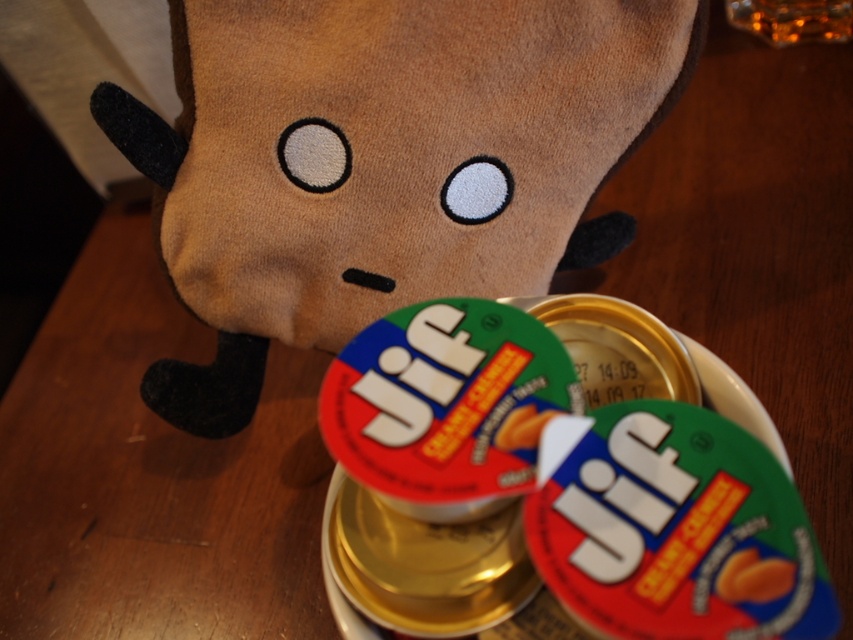
Can you confirm if brown plush toy at upper center is positioned above smooth plastic peanut butter cup at center?

Indeed, brown plush toy at upper center is positioned over smooth plastic peanut butter cup at center.

Is point (485, 74) behind point (546, 412)?

Yes, it is behind point (546, 412).

At what (x,y) coordinates should I click in order to perform the action: click on brown plush toy at upper center. Please return your answer as a coordinate pair (x, y). Image resolution: width=853 pixels, height=640 pixels. Looking at the image, I should click on (383, 163).

Is point (633, 115) positioned in front of point (722, 593)?

No, (633, 115) is behind (722, 593).

What are the coordinates of `brown plush toy at upper center` in the screenshot? It's located at pos(383,163).

Who is more forward, (769,570) or (514,410)?

Point (769,570) is in front.

Is smooth orange almond butter at center shorter than smooth plastic peanut butter cup at center?

Indeed, smooth orange almond butter at center has a lesser height compared to smooth plastic peanut butter cup at center.

Is point (776, 579) positioned in front of point (515, 412)?

That is True.

Identify the location of smooth orange almond butter at center. This screenshot has width=853, height=640. (753, 577).